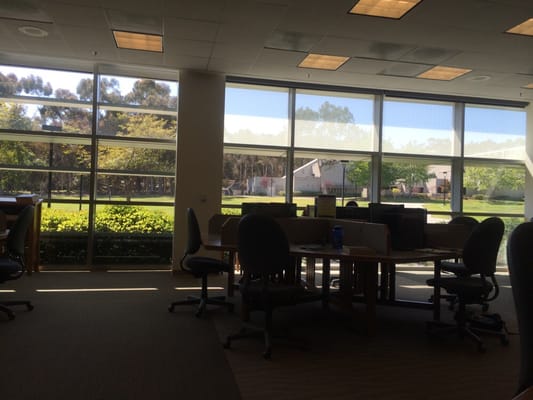
This screenshot has height=400, width=533. I want to click on swivel office chairs, so click(x=7, y=265), click(x=196, y=267), click(x=266, y=296), click(x=470, y=289), click(x=452, y=263), click(x=352, y=201), click(x=521, y=274).